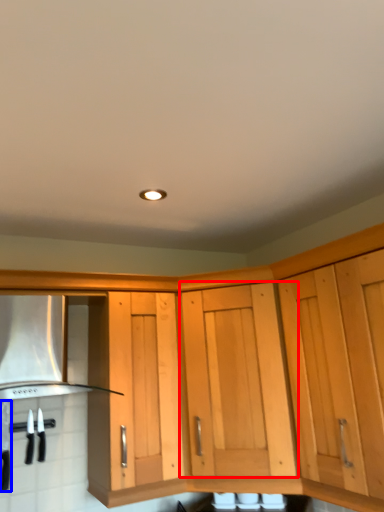
Question: Among these objects, which one is farthest to the camera, cabinetry (highlighted by a red box) or kitchen appliance (highlighted by a blue box)?

Choices:
 (A) cabinetry
 (B) kitchen appliance

Answer: (B)